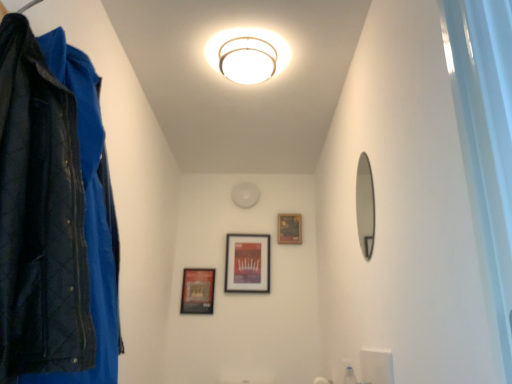
Question: Can you confirm if black matte picture frame at center, the 2th picture frame from the left, is bigger than matte black picture frame at center, which ranks as the first picture frame in right-to-left order?

Choices:
 (A) yes
 (B) no

Answer: (A)

Question: Does black matte picture frame at center, the 2th picture frame from the left, touch matte black picture frame at center, which is the third picture frame from left to right?

Choices:
 (A) yes
 (B) no

Answer: (B)

Question: Does black matte picture frame at center, the 2th picture frame from the left, come behind matte black picture frame at center, which is the third picture frame from left to right?

Choices:
 (A) no
 (B) yes

Answer: (A)

Question: From a real-world perspective, is black matte picture frame at center, marked as the 2th picture frame in a right-to-left arrangement, positioned over matte black picture frame at center, which ranks as the first picture frame in right-to-left order, based on gravity?

Choices:
 (A) no
 (B) yes

Answer: (A)

Question: Is black matte picture frame at center, the 2th picture frame from the left, smaller than matte black picture frame at center, which is the third picture frame from left to right?

Choices:
 (A) no
 (B) yes

Answer: (A)

Question: From the image's perspective, is matte black picture frame at center, which is the third picture frame from left to right, positioned above or below smooth silver mirror at right?

Choices:
 (A) above
 (B) below

Answer: (B)

Question: From a real-world perspective, is matte black picture frame at center, which is the third picture frame from left to right, physically located above or below smooth silver mirror at right?

Choices:
 (A) above
 (B) below

Answer: (A)

Question: Would you say matte black picture frame at center, which is the third picture frame from left to right, is to the left or to the right of smooth silver mirror at right in the picture?

Choices:
 (A) left
 (B) right

Answer: (A)

Question: In terms of width, does matte black picture frame at center, which is the third picture frame from left to right, look wider or thinner when compared to smooth silver mirror at right?

Choices:
 (A) wide
 (B) thin

Answer: (A)

Question: Is transparent plastic bottle at lower right in front of or behind matte black picture frame at lower left, which is the 1th picture frame in left-to-right order, in the image?

Choices:
 (A) front
 (B) behind

Answer: (A)

Question: Is transparent plastic bottle at lower right to the left or to the right of matte black picture frame at lower left, positioned as the third picture frame in right-to-left order, in the image?

Choices:
 (A) left
 (B) right

Answer: (B)

Question: Is transparent plastic bottle at lower right wider or thinner than matte black picture frame at lower left, which is the 1th picture frame in left-to-right order?

Choices:
 (A) thin
 (B) wide

Answer: (B)

Question: From the image's perspective, is transparent plastic bottle at lower right located above or below matte black picture frame at lower left, which is the 1th picture frame in left-to-right order?

Choices:
 (A) below
 (B) above

Answer: (A)

Question: Would you say transparent plastic bottle at lower right is to the left or to the right of matte black picture frame at center, which is the third picture frame from left to right, in the picture?

Choices:
 (A) right
 (B) left

Answer: (A)

Question: From the image's perspective, is transparent plastic bottle at lower right positioned above or below matte black picture frame at center, which ranks as the first picture frame in right-to-left order?

Choices:
 (A) above
 (B) below

Answer: (B)